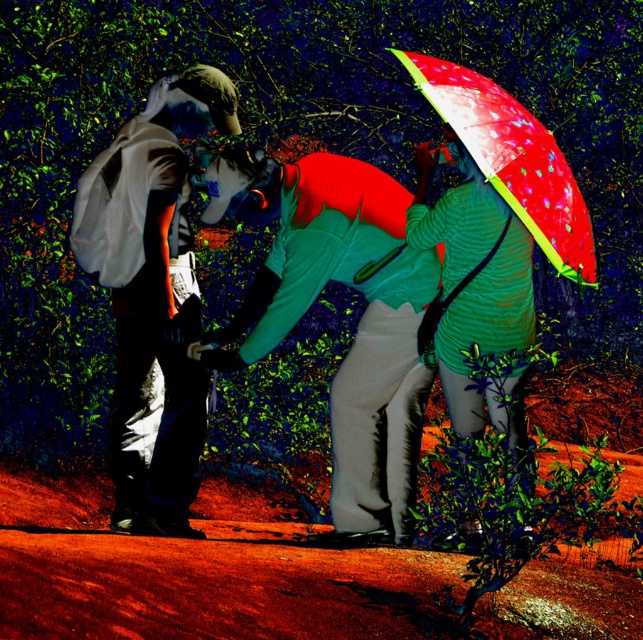
You are planning to place a small bench in the forest scene so that it won not block the view of the green striped sweater at center. According to the coordinates provided, where should you place the bench?

The green striped sweater at center is located at coordinates point (473,289). To avoid blocking its view, the bench should be placed away from this position, perhaps to the left or right side of the sweater.

You are standing in a forest and see two umbrellas at the upper right corner. Which one is closer to you, the matte green umbrella at upper right or the translucent plastic umbrella at upper right?

The matte green umbrella at upper right is closer to you because it is further to the viewer than the translucent plastic umbrella at upper right.

You are planning to take a photo of the scene. The matte green umbrella at upper right and the green striped sweater at center are both in the frame. Since the umbrella is larger, which object will appear bigger in the photo?

The matte green umbrella at upper right will appear bigger in the photo because it has a larger size compared to the green striped sweater at center.